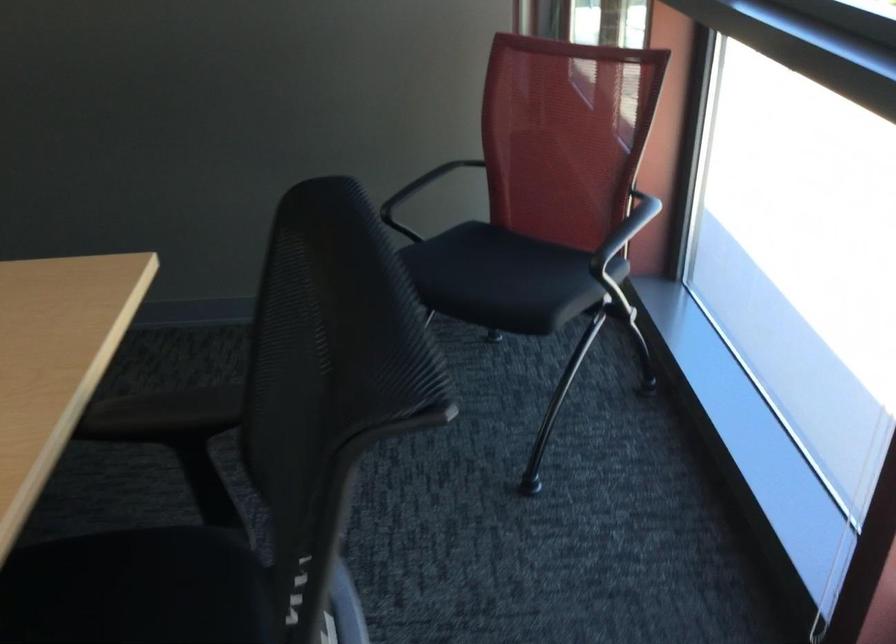
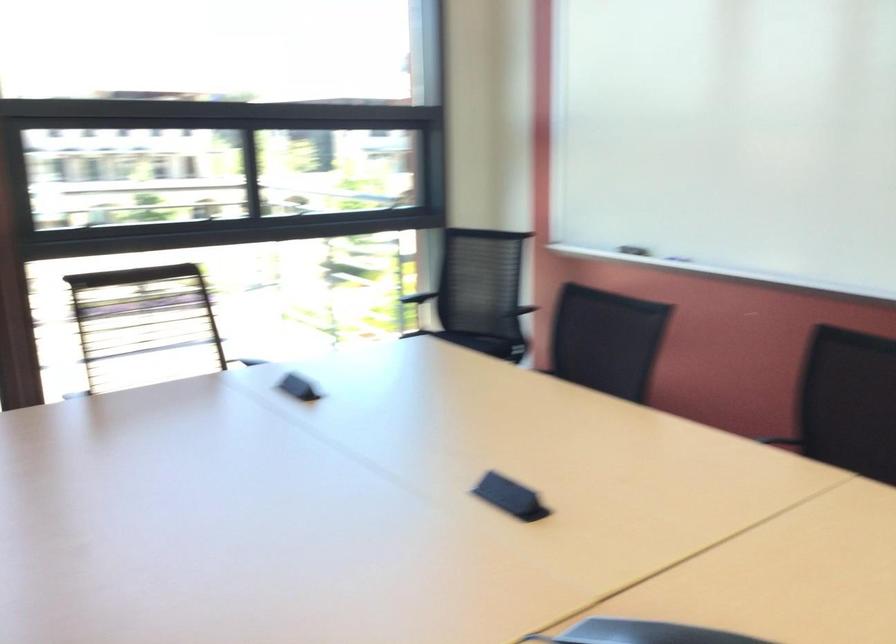
Question: I am providing you with two images of the same scene from different viewpoints. After the viewpoint changes to image2, which objects are now occluded?

Choices:
 (A) small brown figurine
 (B) black chair armrest
 (C) chair sitting surface
 (D) whiteboard eraser

Answer: (C)